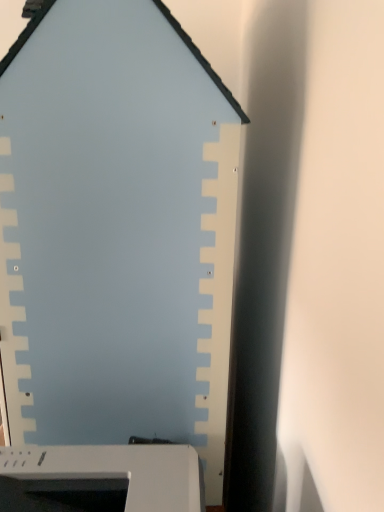
Question: Should I look upward or downward to see light blue matte board at center?

Choices:
 (A) up
 (B) down

Answer: (A)